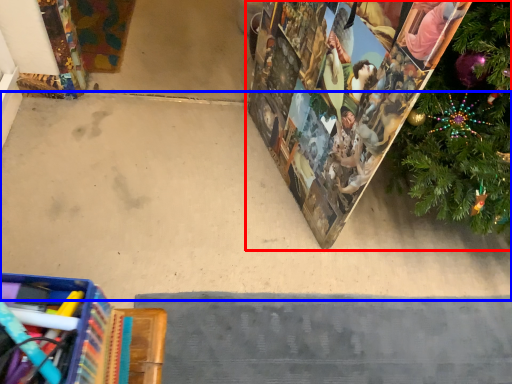
Question: Among these objects, which one is farthest to the camera, christmas decoration (highlighted by a red box) or concrete (highlighted by a blue box)?

Choices:
 (A) christmas decoration
 (B) concrete

Answer: (B)